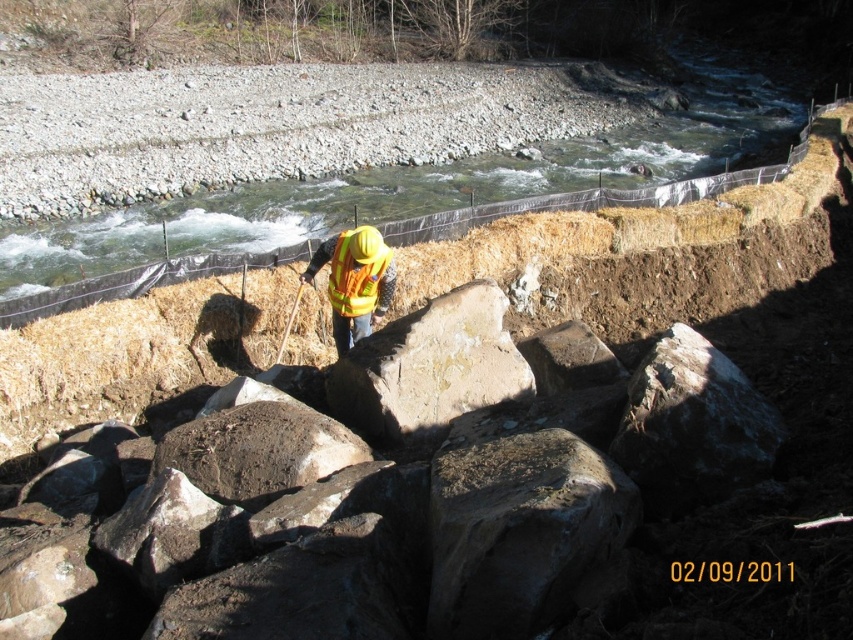
Is point (422, 406) closer to viewer compared to point (387, 256)?

Yes, point (422, 406) is in front of point (387, 256).

The width and height of the screenshot is (853, 640). I want to click on smooth gray rock at center, so tap(428, 368).

Can you confirm if smooth gray rock at center is positioned below high visibility fabric safety vest at center?

Yes.

Between point (378, 365) and point (357, 284), which one is positioned behind?

Positioned behind is point (357, 284).

Where is `smooth gray rock at center`? This screenshot has height=640, width=853. smooth gray rock at center is located at coordinates (428, 368).

Who is higher up, rusty metallic rock at center or smooth gray rock at center?

Positioned higher is smooth gray rock at center.

Who is more distant from viewer, (x=527, y=602) or (x=421, y=390)?

The point (x=421, y=390) is more distant.

Which is in front, point (631, 496) or point (392, 428)?

Positioned in front is point (631, 496).

Locate an element on the screen. rusty metallic rock at center is located at coordinates (519, 531).